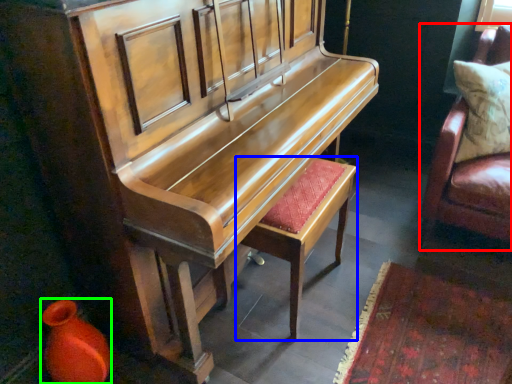
Question: Which object is the closest to the furniture (highlighted by a red box)? Choose among these: stool (highlighted by a blue box) or vase (highlighted by a green box).

Choices:
 (A) stool
 (B) vase

Answer: (A)